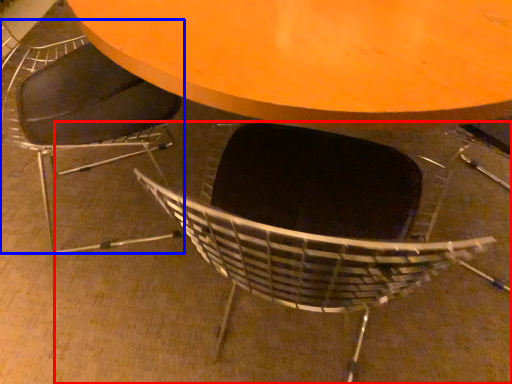
Question: Among these objects, which one is farthest to the camera, chair (highlighted by a red box) or chair (highlighted by a blue box)?

Choices:
 (A) chair
 (B) chair

Answer: (B)